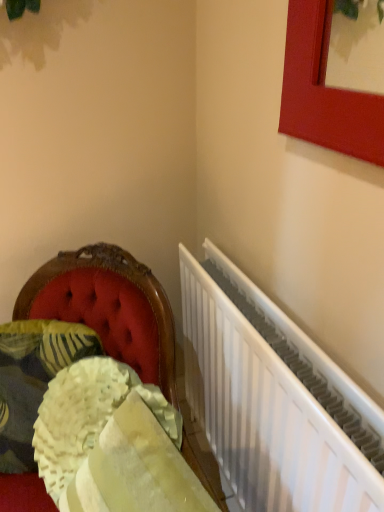
Question: Does fluffy white pillow at lower left contain white metallic radiator at right?

Choices:
 (A) no
 (B) yes

Answer: (A)

Question: Does fluffy white pillow at lower left have a lesser height compared to white metallic radiator at right?

Choices:
 (A) yes
 (B) no

Answer: (A)

Question: Could you tell me if fluffy white pillow at lower left is turned towards white metallic radiator at right?

Choices:
 (A) no
 (B) yes

Answer: (A)

Question: From the image's perspective, is fluffy white pillow at lower left below white metallic radiator at right?

Choices:
 (A) yes
 (B) no

Answer: (B)

Question: Is fluffy white pillow at lower left at the left side of white metallic radiator at right?

Choices:
 (A) yes
 (B) no

Answer: (A)

Question: Considering the positions of fluffy white pillow at lower left and velvet cushion at left in the image, is fluffy white pillow at lower left taller or shorter than velvet cushion at left?

Choices:
 (A) short
 (B) tall

Answer: (A)

Question: Is fluffy white pillow at lower left in front of or behind velvet cushion at left in the image?

Choices:
 (A) front
 (B) behind

Answer: (B)

Question: In the image, is fluffy white pillow at lower left on the left side or the right side of velvet cushion at left?

Choices:
 (A) right
 (B) left

Answer: (B)

Question: Considering the positions of fluffy white pillow at lower left and velvet cushion at left in the image, is fluffy white pillow at lower left bigger or smaller than velvet cushion at left?

Choices:
 (A) big
 (B) small

Answer: (B)

Question: Is white metallic radiator at right in front of or behind fluffy cream cushion at lower left in the image?

Choices:
 (A) behind
 (B) front

Answer: (A)

Question: From a real-world perspective, is white metallic radiator at right above or below fluffy cream cushion at lower left?

Choices:
 (A) below
 (B) above

Answer: (A)

Question: Is white metallic radiator at right bigger or smaller than fluffy cream cushion at lower left?

Choices:
 (A) big
 (B) small

Answer: (A)

Question: Would you say white metallic radiator at right is to the left or to the right of fluffy cream cushion at lower left in the picture?

Choices:
 (A) left
 (B) right

Answer: (B)

Question: Would you say velvet cushion at left is to the left or to the right of white metallic radiator at right in the picture?

Choices:
 (A) right
 (B) left

Answer: (B)

Question: Based on their sizes in the image, would you say velvet cushion at left is bigger or smaller than white metallic radiator at right?

Choices:
 (A) small
 (B) big

Answer: (A)